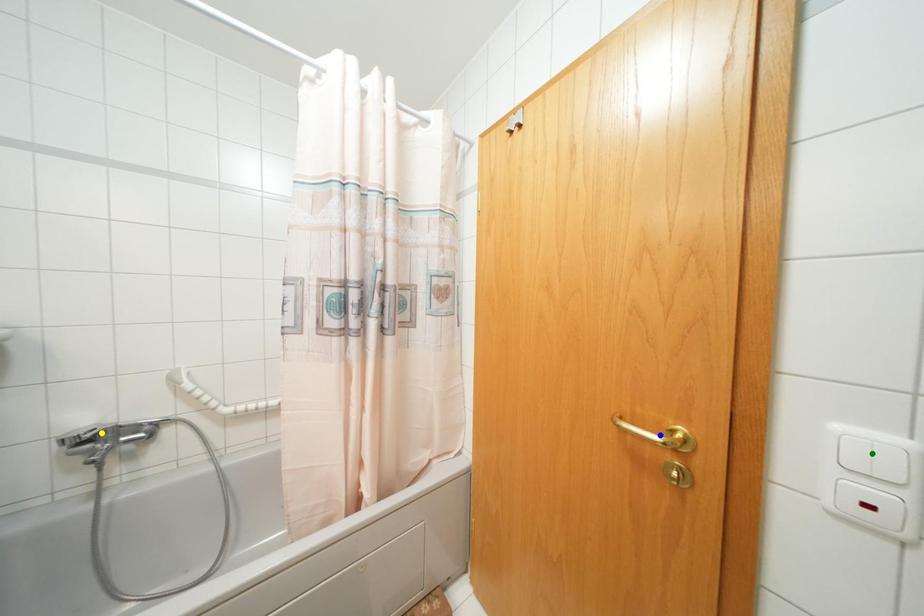
Order these from nearest to farthest:
- blue point
- yellow point
- green point

1. green point
2. blue point
3. yellow point